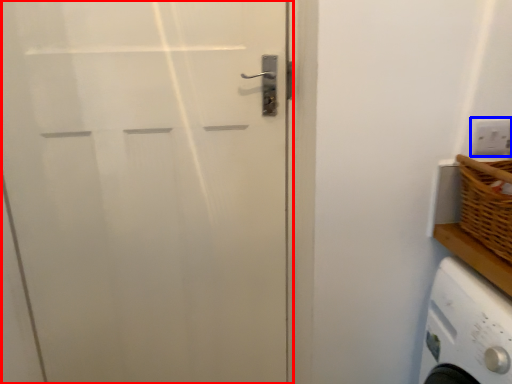
Question: Which object appears farthest to the camera in this image, door (highlighted by a red box) or electric outlet (highlighted by a blue box)?

Choices:
 (A) door
 (B) electric outlet

Answer: (B)